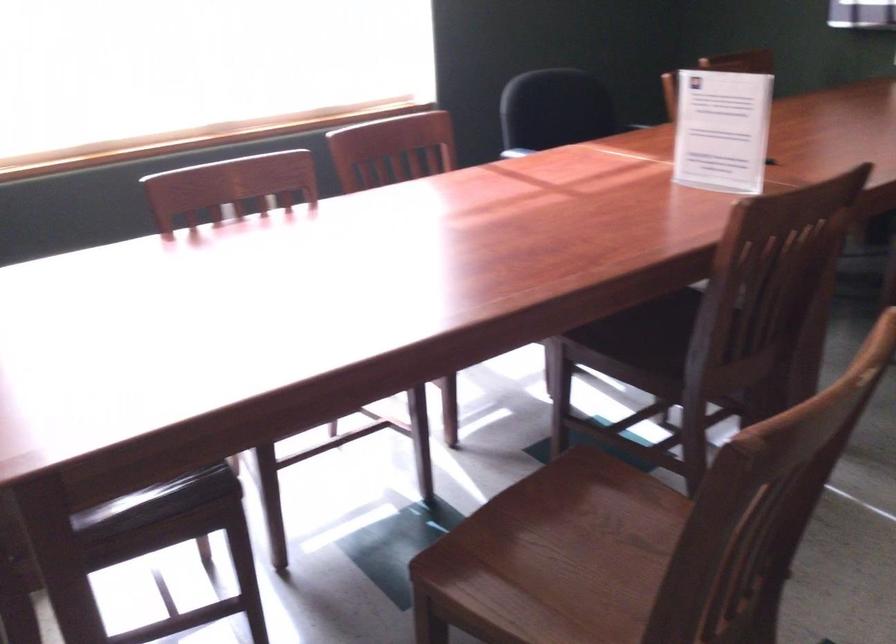
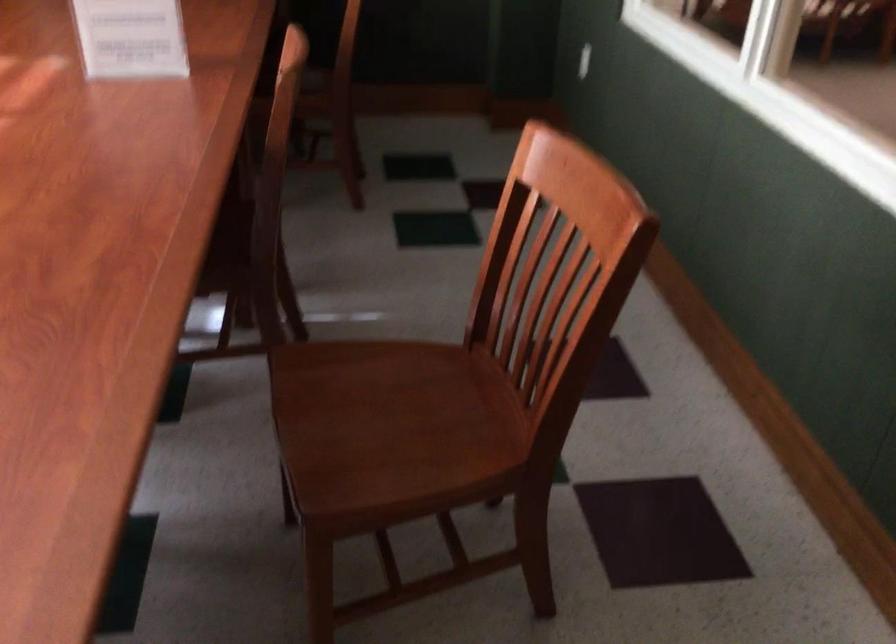
How did the camera likely rotate?

The camera rotated toward right-down.